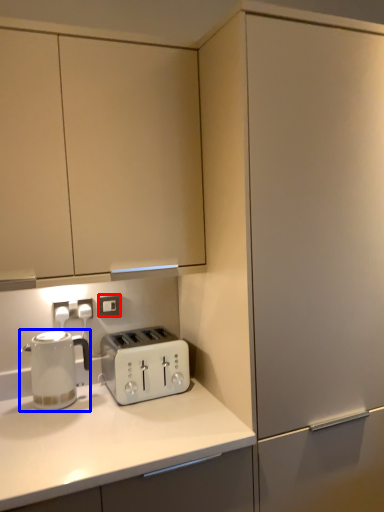
Question: Which point is further to the camera, electric outlet (highlighted by a red box) or home appliance (highlighted by a blue box)?

Choices:
 (A) electric outlet
 (B) home appliance

Answer: (A)